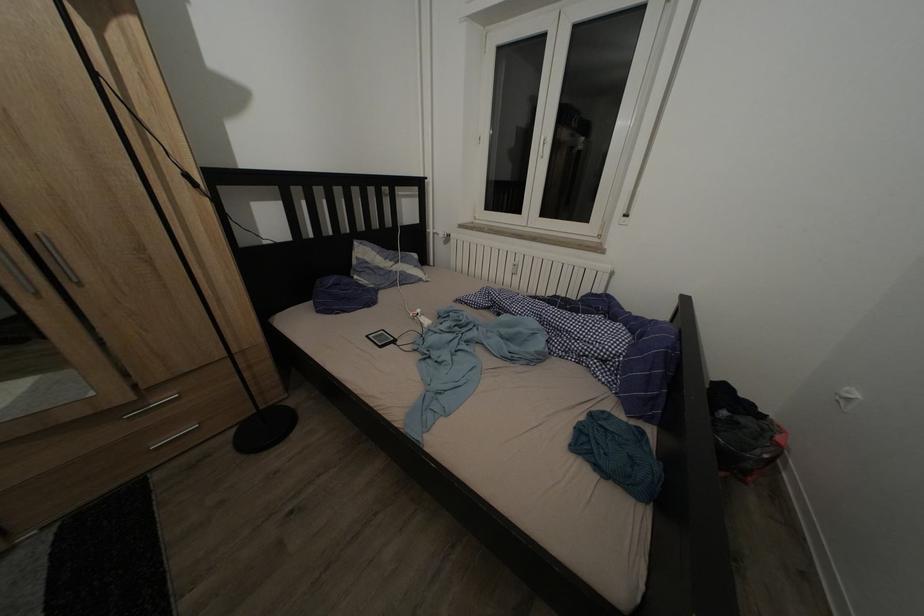
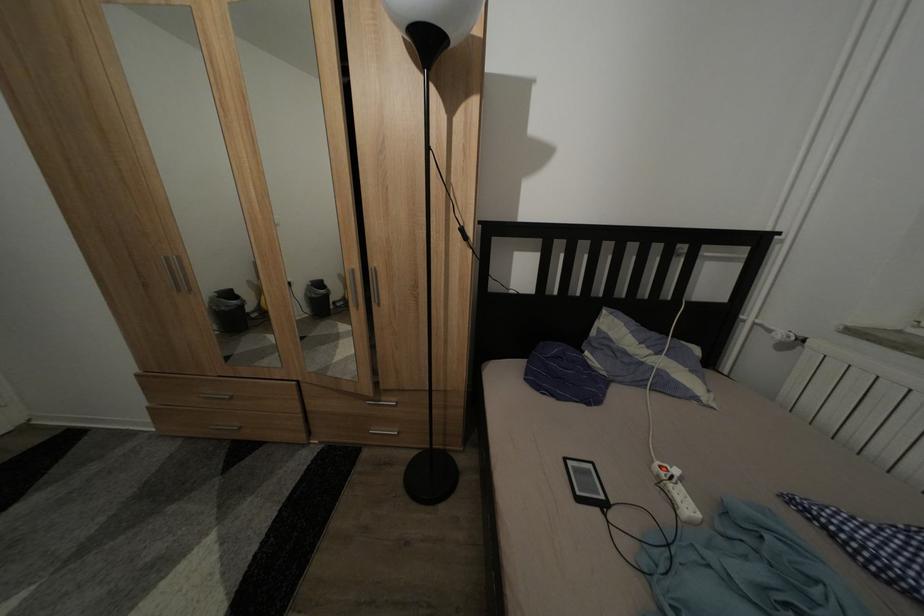
In the second image, find the point that corresponds to (374,342) in the first image.

(573, 466)